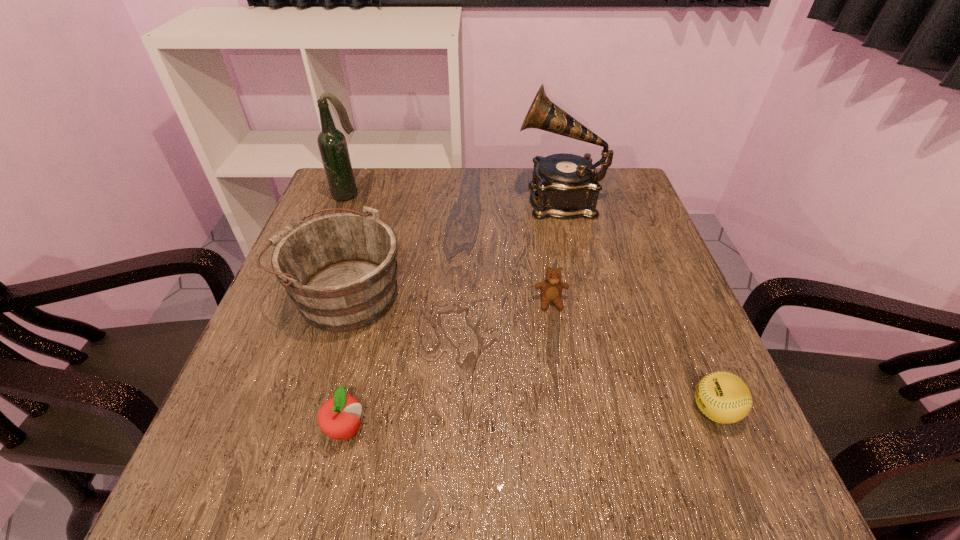
Identify the location of phonograph record situated at the right edge. The width and height of the screenshot is (960, 540). pos(564,185).

The width and height of the screenshot is (960, 540). I want to click on softball present at the right edge, so click(723, 397).

Locate an element on the screen. object that is at the far left corner is located at coordinates (332, 143).

Where is `object that is at the far right corner`? object that is at the far right corner is located at coordinates (564, 185).

In the image, there is a desktop. Where is `vacant area at the far edge`? The width and height of the screenshot is (960, 540). vacant area at the far edge is located at coordinates (413, 215).

Locate an element on the screen. The width and height of the screenshot is (960, 540). vacant space at the right edge is located at coordinates (645, 297).

Find the location of `free space at the near right corner of the desktop`. free space at the near right corner of the desktop is located at coordinates (770, 476).

Identify the location of free space that is in between the softball and the teddy bear. The width and height of the screenshot is (960, 540). point(633,356).

The width and height of the screenshot is (960, 540). I want to click on vacant point located between the phonograph record and the softball, so click(636, 305).

Locate an element on the screen. free spot between the beer bottle and the softball is located at coordinates (531, 302).